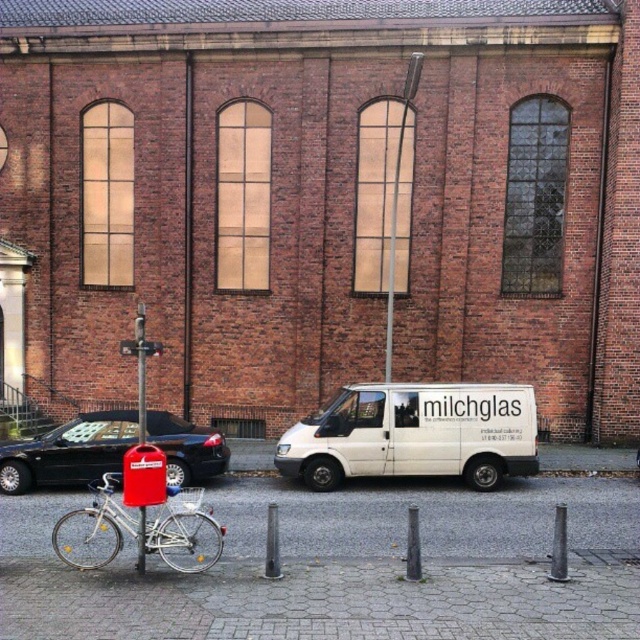
Looking at this image, you are a delivery person who needs to park your white matte van at center in a space that requires vehicles to be shorter than the silver metallic bicycle at lower left. Can your van fit in that space?

The white matte van at center is taller than the silver metallic bicycle at lower left, so it cannot fit in the space that requires vehicles to be shorter than the bicycle.

You are a delivery person who needs to park your van between the shiny black car at lower left and the silver metallic bicycle at lower left. Is there enough space between them to fit your van?

The shiny black car at lower left has a larger size compared to silver metallic bicycle at lower left. The space between them may be sufficient for the van, but since the exact distance isn

Based on the photo, you are a delivery person who needs to park your van in a way that it doesn not block the bicycle. Based on the scene, can you determine if the white matte van at center is currently blocking the silver metallic bicycle at lower left?

The white matte van at center is above the silver metallic bicycle at lower left, so it is blocking the bicycle. Move the van to another spot to avoid blocking the bicycle.